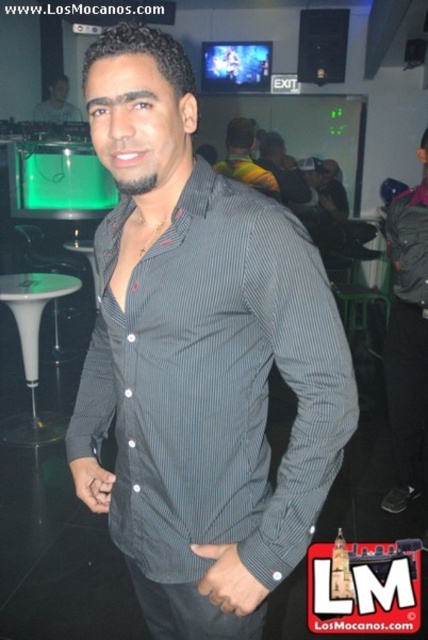
You are a bouncer at the entrance of the nightclub. A new patron wants to sit at the green plastic bar stool at center but is currently standing near the striped shirt at center. Can they reach the stool without moving more than 6 feet?

The striped shirt at center is 6.01 feet away from the green plastic bar stool at center. Since the distance is slightly over 6 feet, the patron would need to move a bit more than 6 feet to reach the stool.

You are a photographer positioned at the entrance of the nightclub. You want to take a photo that includes both the striped cotton shirt at center and the white plastic bar stool at lower left. Based on their positions, which object should you adjust your camera angle to focus on first to ensure both are in frame?

The striped cotton shirt at center is to the right of the white plastic bar stool at lower left. To capture both in the frame, you should first focus on the white plastic bar stool at lower left since it is positioned further to the left, ensuring there is enough space to include the striped cotton shirt at center to its right.

You are a photographer trying to capture a candid shot of the striped cotton shirt at center and the white plastic bar stool at lower left. Since you want to include both in the frame, which object should you focus on first to ensure both are in focus?

The striped cotton shirt at center has a lesser height compared to white plastic bar stool at lower left, so you should focus on the white plastic bar stool at lower left first to ensure both are in focus.